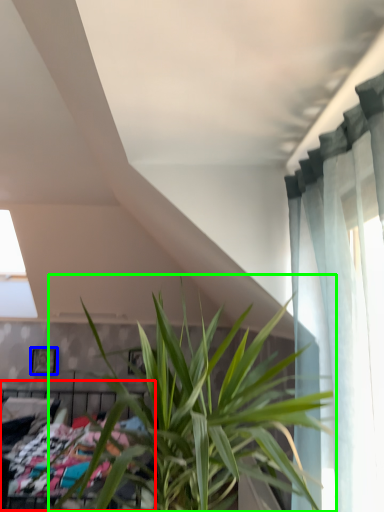
Question: Which is farther away from bed (highlighted by a red box)? picture frame (highlighted by a blue box) or houseplant (highlighted by a green box)?

Choices:
 (A) picture frame
 (B) houseplant

Answer: (A)